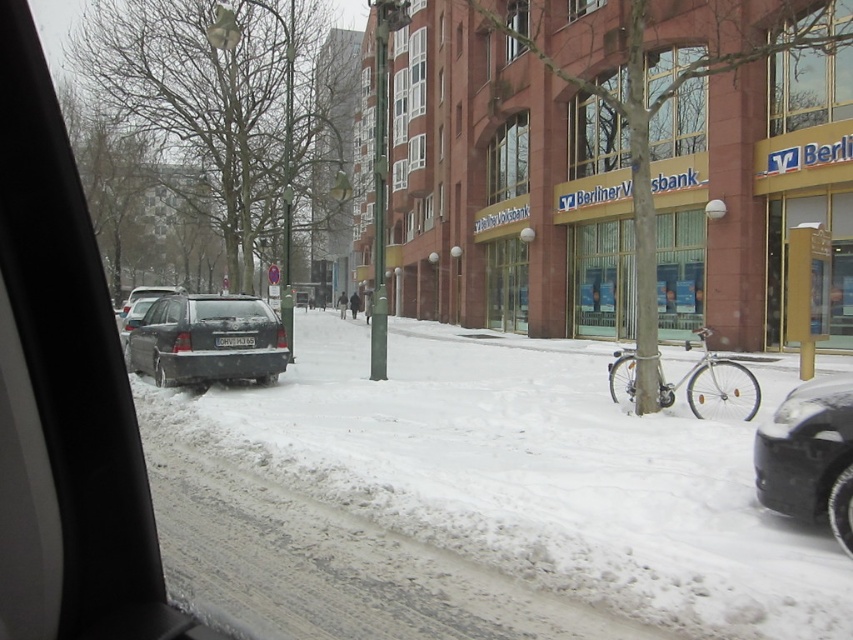
Consider the image. You are driving a car that is 5 meters long and need to park in a space between the black rubber car at lower right and the building with the Berliner Volksbank sign. Can your car fit in this space?

The space between the black rubber car at lower right and the building with the Berliner Volksbank sign is 5.29 meters, so yes, your car which is 5 meters long can fit in this space since it is slightly longer than the car.

Looking at this image, you are driving a car and want to park near the Berliner Volksbank. The parking spot you want is marked by the point at coordinates (786, 515). If your car is 4.5 meters long, will you be able to park there without hitting the parked sedan on the right side of the street?

The distance between the point at coordinates (786, 515) and the camera is 5.94 meters. Since your car is 4.5 meters long, which is shorter than the available space of 5.94 meters, you can park there without hitting the parked sedan on the right side of the street.

You are driving a car with a length of 4.5 meters and need to park it in the space between the two points marked as point (177, 300). Is there enough space for your car?

The distance between the two points is 14.27 meters, which is more than enough to accommodate a car that is 4.5 meters long.